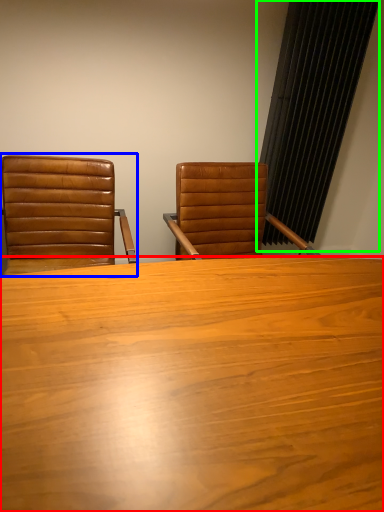
Question: Which object is positioned farthest from table (highlighted by a red box)? Select from chair (highlighted by a blue box) and curtain (highlighted by a green box).

Choices:
 (A) chair
 (B) curtain

Answer: (B)